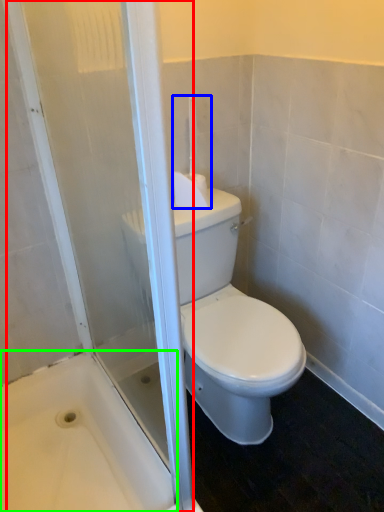
Question: Which object is positioned farthest from screen door (highlighted by a red box)? Select from towel bar (highlighted by a blue box) and bath (highlighted by a green box).

Choices:
 (A) towel bar
 (B) bath

Answer: (A)